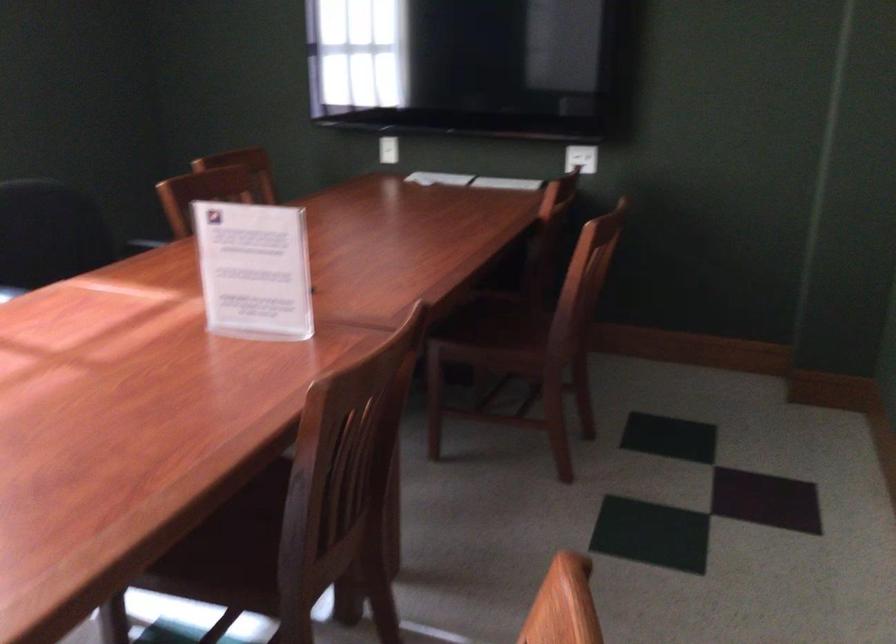
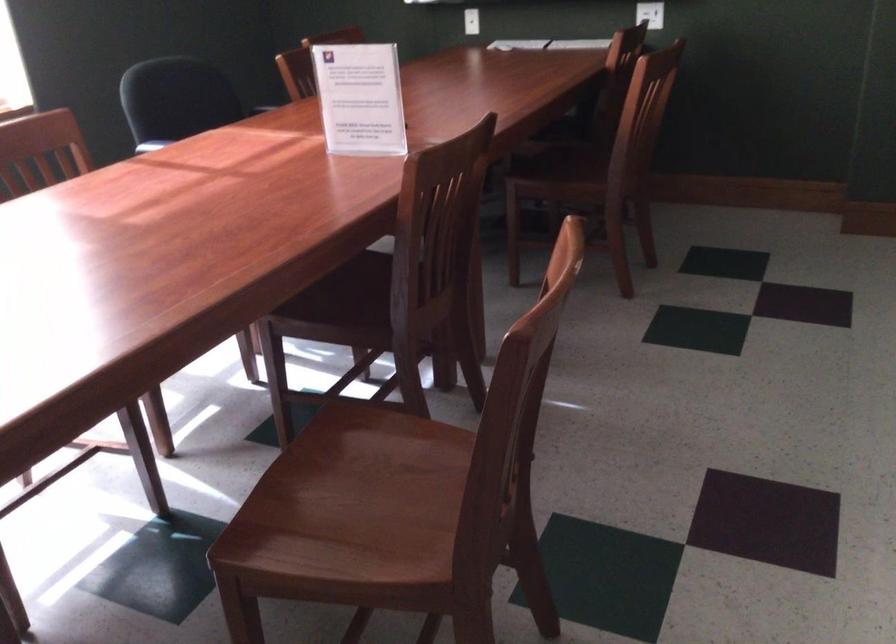
The point at (391, 152) is marked in the first image. Where is the corresponding point in the second image?

(471, 21)